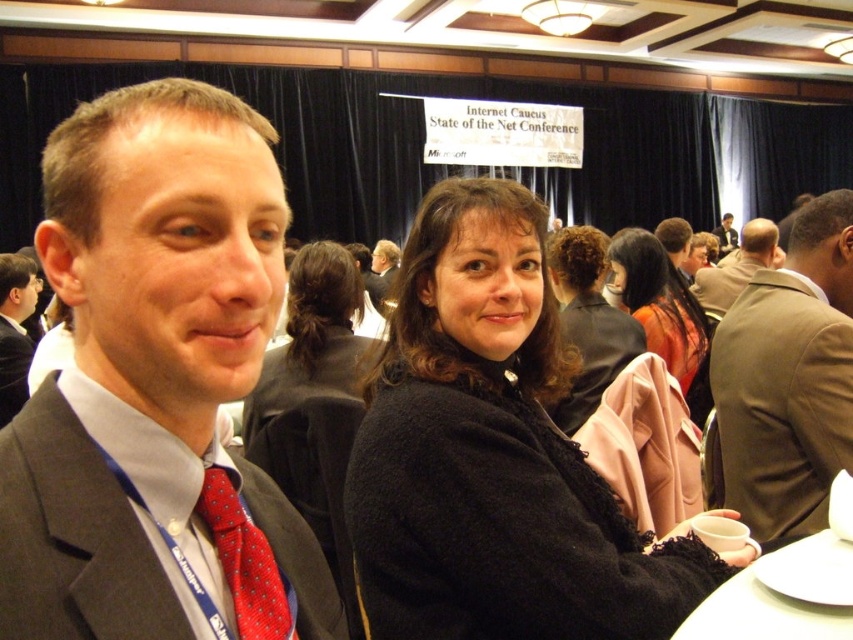
You are organizing a photo shoot and need to decide which coat to use based on their sizes. Given that the orange fabric coat at center and the matte black jacket at center are both at the center of the image, which one would you choose if you want a wider coat for the background?

The orange fabric coat at center has a larger width than the matte black jacket at center, so you should choose the orange fabric coat at center for a wider appearance in the background.

You are attending the Internet Caucus State of the Net Conference and notice two attendees dressed in an orange fabric coat at center and a matte black suit at upper center. Based on their attire, which one is shorter in length?

The orange fabric coat at center is shorter than the matte black suit at upper center.